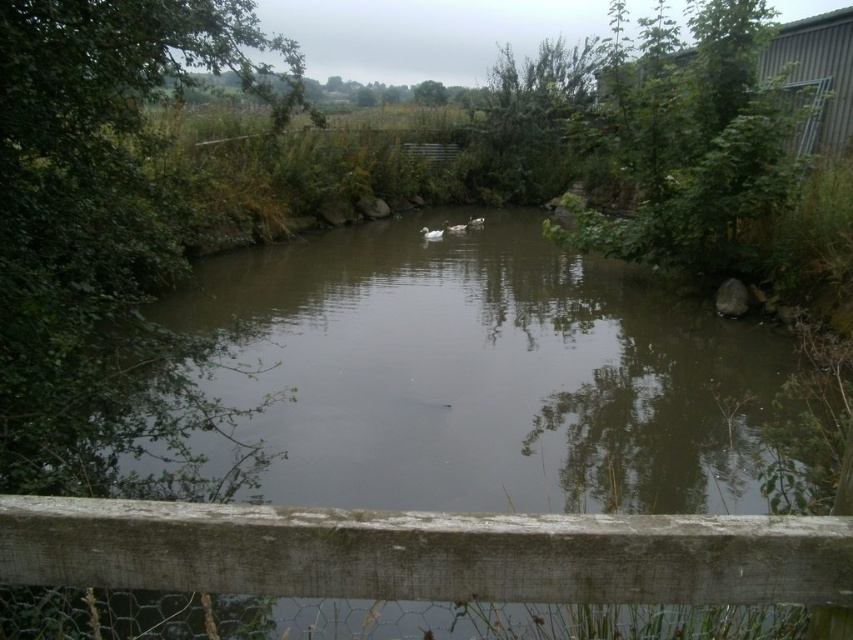
You are a photographer trying to capture the entire view of the pond. You notice the brown murky water at center and the weathered wood fence at lower center. Which object would block more of your camera view if you position yourself to focus on the pond?

The brown murky water at center is bigger than the weathered wood fence at lower center, so it would block more of your camera view when focusing on the pond.